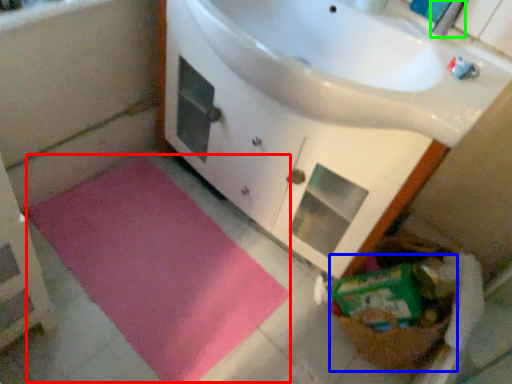
Question: Which object is the closest to the bath mat (highlighted by a red box)? Choose among these: basket (highlighted by a blue box) or faucet (highlighted by a green box).

Choices:
 (A) basket
 (B) faucet

Answer: (A)